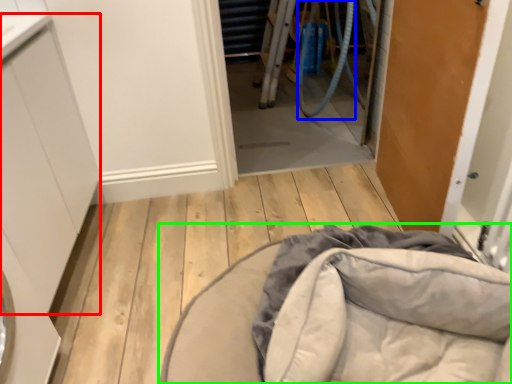
Question: Estimate the real-world distances between objects in this image. Which object is closer to cabinetry (highlighted by a red box), garden hose (highlighted by a blue box) or furniture (highlighted by a green box)?

Choices:
 (A) garden hose
 (B) furniture

Answer: (B)